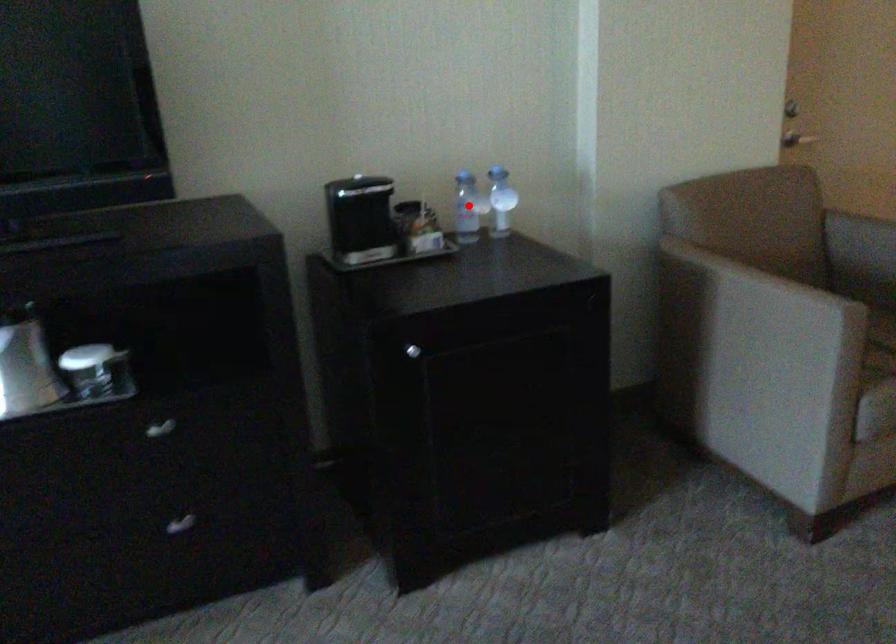
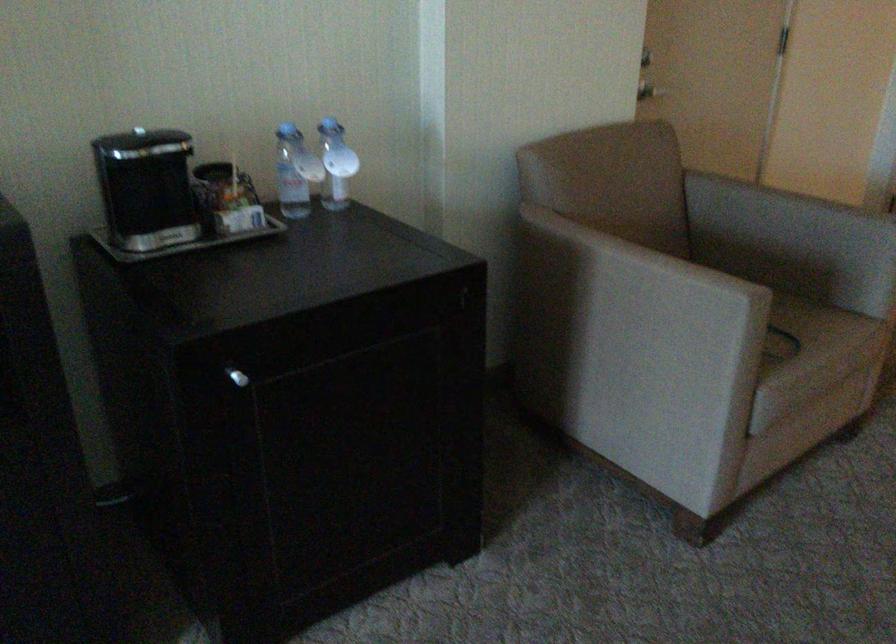
Question: A red point is marked in image1. In image2, is the corresponding 3D point closer to the camera or farther? Reply with the corresponding letter.

Choices:
 (A) The corresponding 3D point is closer.
 (B) The corresponding 3D point is farther.

Answer: (A)